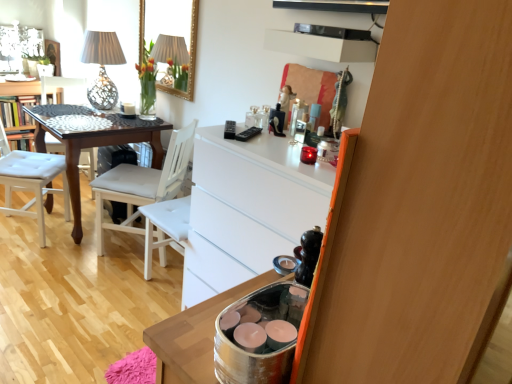
Question: In terms of width, does wooden dresser at right look wider or thinner when compared to matte white lampshade at upper left?

Choices:
 (A) wide
 (B) thin

Answer: (B)

Question: From their relative heights in the image, would you say wooden dresser at right is taller or shorter than matte white lampshade at upper left?

Choices:
 (A) short
 (B) tall

Answer: (B)

Question: Which object is positioned closest to the silver metallic container at lower right?

Choices:
 (A) dark wood table at left
 (B) white glossy vanity at upper left
 (C) matte white lampshade at upper left
 (D) white fabric chair at center, which appears as the third chair when viewed from the left
 (E) white tufted chair at left, marked as the 2th chair in a left-to-right arrangement

Answer: (D)

Question: Which of these objects is positioned closest to the white fabric chair at center, which appears as the third chair when viewed from the left?

Choices:
 (A) white tufted chair at left, which appears as the second chair when viewed from the right
 (B) wooden dresser at right
 (C) dark wood table at left
 (D) matte white lampshade at upper left
 (E) white tufted chair at left, which is counted as the 1th chair, starting from the left

Answer: (C)